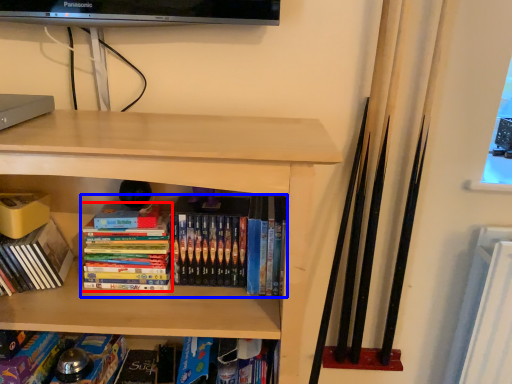
Question: Which object appears closest to the camera in this image, book (highlighted by a red box) or book (highlighted by a blue box)?

Choices:
 (A) book
 (B) book

Answer: (B)